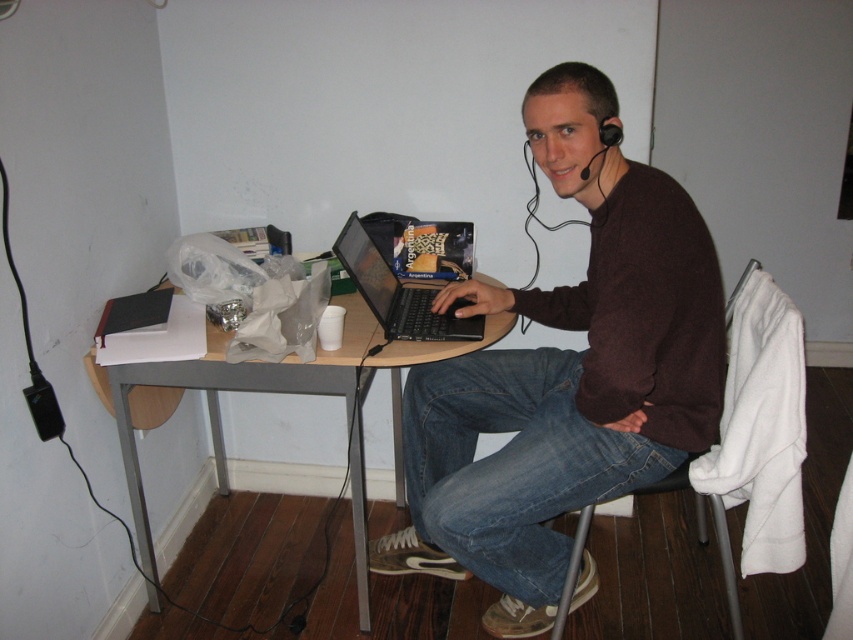
Is brown sweater at center above black plastic chair at lower center?

Yes, brown sweater at center is above black plastic chair at lower center.

Is point (451, 435) positioned before point (577, 548)?

No, (451, 435) is further to viewer.

Locate an element on the screen. The image size is (853, 640). brown sweater at center is located at coordinates (566, 372).

Between brown sweater at center and woodenmaterial/texturetable at center, which one appears on the left side from the viewer's perspective?

From the viewer's perspective, woodenmaterial/texturetable at center appears more on the left side.

Is point (589, 192) in front of point (201, 480)?

Yes, point (589, 192) is closer to viewer.

Image resolution: width=853 pixels, height=640 pixels. I want to click on brown sweater at center, so click(566, 372).

From the picture: Who is higher up, woodenmaterial/texturetable at center or shiny black laptop at center?

shiny black laptop at center is higher up.

Is woodenmaterial/texturetable at center taller than shiny black laptop at center?

Correct, woodenmaterial/texturetable at center is much taller as shiny black laptop at center.

Who is more forward, (175, 378) or (424, 304)?

Point (175, 378) is more forward.

Where is `woodenmaterial/texturetable at center`? This screenshot has width=853, height=640. woodenmaterial/texturetable at center is located at coordinates (218, 406).